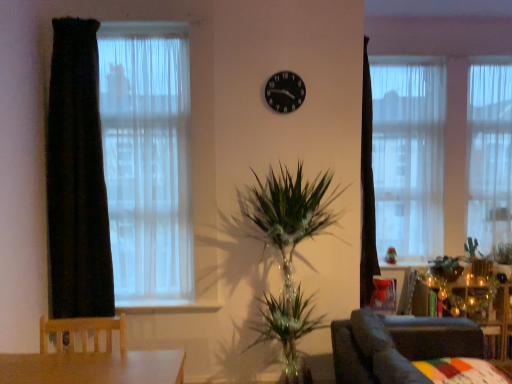
The height and width of the screenshot is (384, 512). I want to click on vacant space underneath white sheer curtain at upper right, the second curtain in the back-to-front sequence (from a real-world perspective), so click(408, 259).